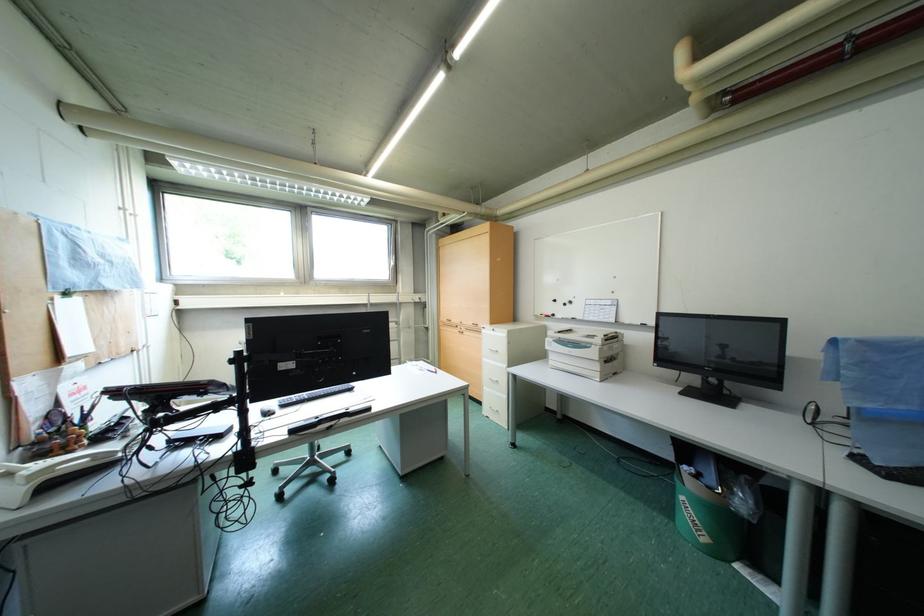
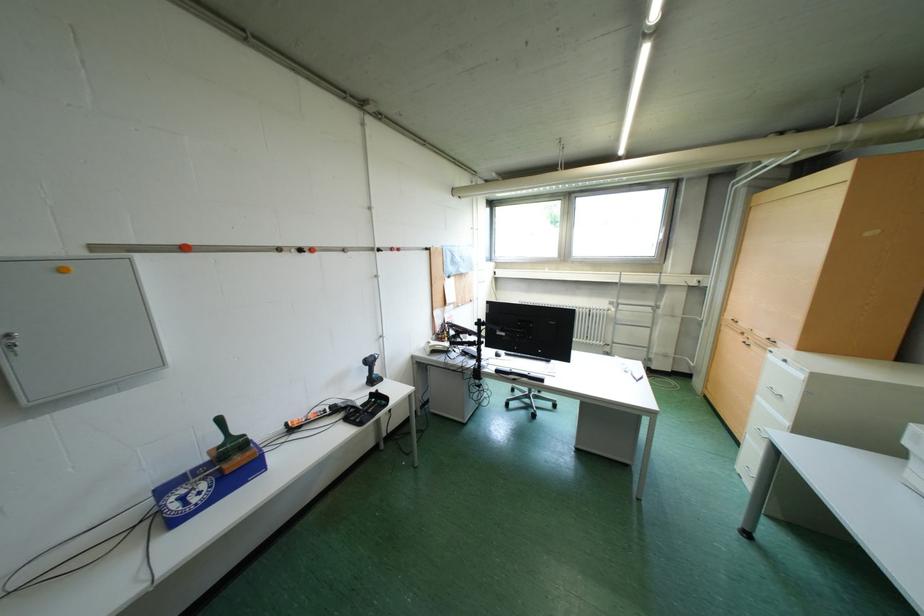
Question: The images are taken continuously from a first-person perspective. In which direction is your viewpoint rotating?

Choices:
 (A) Left
 (B) Right
 (C) Up
 (D) Down

Answer: (A)